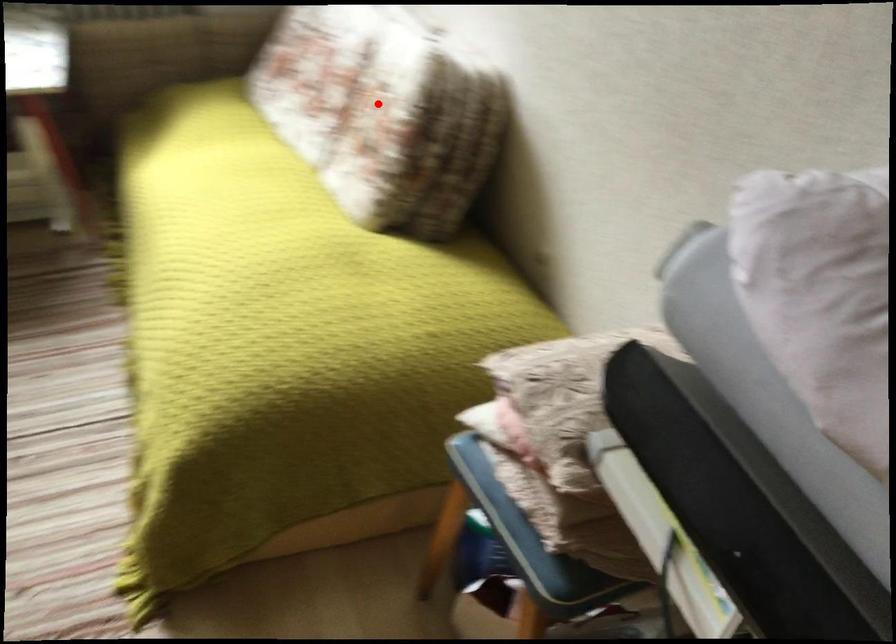
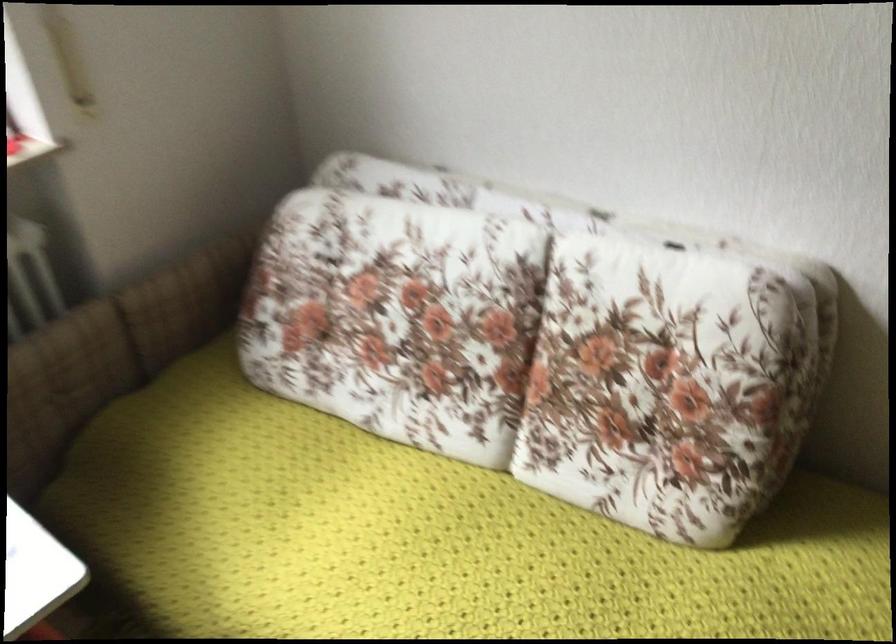
The point at the highlighted location is marked in the first image. Where is the corresponding point in the second image?

(650, 359)